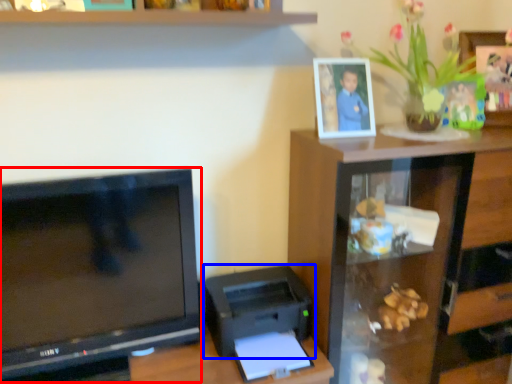
Question: Which of the following is the closest to the observer, television (highlighted by a red box) or printer (highlighted by a blue box)?

Choices:
 (A) television
 (B) printer

Answer: (A)